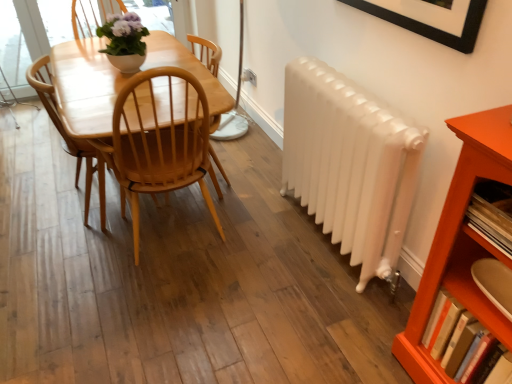
The image size is (512, 384). Find the location of `matte white pot at upper center`. matte white pot at upper center is located at coordinates (124, 41).

Describe the element at coordinates (455, 226) in the screenshot. I see `orange wood shelf at lower right` at that location.

The width and height of the screenshot is (512, 384). In order to click on light brown wood chair at center in this screenshot , I will do `click(70, 136)`.

Locate an element on the screen. The image size is (512, 384). hardcover book at lower right, the 1th book when ordered from bottom to top is located at coordinates (450, 333).

The width and height of the screenshot is (512, 384). Describe the element at coordinates (492, 214) in the screenshot. I see `wooden bookshelf at right, the 1th book viewed from the top` at that location.

Find the location of a particular element. The width and height of the screenshot is (512, 384). matte white pot at upper center is located at coordinates (124, 41).

Between hardcover book at lower right, the 1th book when ordered from bottom to top, and orange wood shelf at lower right, which one has smaller size?

With smaller size is hardcover book at lower right, the 1th book when ordered from bottom to top.

At what (x,y) coordinates should I click in order to perform the action: click on shelf on the left of the hardcover book at lower right, the 1th book when ordered from bottom to top. Please return your answer as a coordinate pair (x, y). This screenshot has height=384, width=512. Looking at the image, I should click on (455, 226).

Is hardcover book at lower right, the second book when ordered from top to bottom, in front of or behind orange wood shelf at lower right in the image?

hardcover book at lower right, the second book when ordered from top to bottom, is positioned farther from the viewer than orange wood shelf at lower right.

Which point is more distant from viewer, (476, 326) or (494, 115)?

Positioned behind is point (476, 326).

In order to click on chair to the left of matte white pot at upper center in this screenshot , I will do `click(70, 136)`.

Which object is positioned more to the right, matte white pot at upper center or light brown wood chair at center?

matte white pot at upper center is more to the right.

Is the position of matte white pot at upper center more distant than that of light brown wood chair at center?

Yes, it is.

Who is taller, matte white pot at upper center or light brown wood chair at center?

Standing taller between the two is light brown wood chair at center.

From the image's perspective, which is below, orange wood shelf at lower right or matte white pot at upper center?

orange wood shelf at lower right appears lower in the image.

Would you say orange wood shelf at lower right contains matte white pot at upper center?

That's incorrect, matte white pot at upper center is not inside orange wood shelf at lower right.

The width and height of the screenshot is (512, 384). I want to click on houseplant lying on the left of orange wood shelf at lower right, so click(x=124, y=41).

In the scene shown: Between orange wood shelf at lower right and matte white pot at upper center, which one is positioned in front?

Positioned in front is orange wood shelf at lower right.

Is orange wood shelf at lower right beside light brown wood chair at center?

No, orange wood shelf at lower right is not beside light brown wood chair at center.

Considering the sizes of objects orange wood shelf at lower right and light brown wood chair at center in the image provided, who is taller, orange wood shelf at lower right or light brown wood chair at center?

Standing taller between the two is orange wood shelf at lower right.

Is orange wood shelf at lower right completely or partially outside of light brown wood chair at center?

Indeed, orange wood shelf at lower right is completely outside light brown wood chair at center.

Considering their positions, is orange wood shelf at lower right located in front of or behind light brown wood chair at center?

Clearly, orange wood shelf at lower right is in front of light brown wood chair at center.

I want to click on shelf that appears above the hardcover book at lower right, the second book when ordered from top to bottom (from the image's perspective), so click(x=455, y=226).

Between orange wood shelf at lower right and hardcover book at lower right, the second book when ordered from top to bottom, which one has less height?

With less height is hardcover book at lower right, the second book when ordered from top to bottom.

Which is less distant, (504, 182) or (456, 311)?

Point (504, 182).

Is orange wood shelf at lower right not within hardcover book at lower right, the 1th book when ordered from bottom to top?

orange wood shelf at lower right lies outside hardcover book at lower right, the 1th book when ordered from bottom to top,'s area.

Considering the points (37, 84) and (446, 292), which point is behind, point (37, 84) or point (446, 292)?

The point (37, 84) is behind.

From a real-world perspective, who is located higher, light brown wood chair at center or hardcover book at lower right, the second book when ordered from top to bottom?

In real-world perspective, light brown wood chair at center is above.

Does light brown wood chair at center have a greater height compared to hardcover book at lower right, the second book when ordered from top to bottom?

Indeed, light brown wood chair at center has a greater height compared to hardcover book at lower right, the second book when ordered from top to bottom.

Is light brown wood chair at center positioned far away from hardcover book at lower right, the 1th book when ordered from bottom to top?

Yes, light brown wood chair at center and hardcover book at lower right, the 1th book when ordered from bottom to top, are quite far apart.

Is wooden bookshelf at right, the 1th book viewed from the top, wider than light brown wood chair at center?

No.

From the image's perspective, is wooden bookshelf at right, the 1th book viewed from the top, positioned above or below light brown wood chair at center?

Clearly, from the image's perspective, wooden bookshelf at right, the 1th book viewed from the top, is below light brown wood chair at center.

Is point (470, 212) more distant than point (102, 224)?

No, (470, 212) is in front of (102, 224).

From a real-world perspective, is wooden bookshelf at right, placed as the second book when sorted from bottom to top, physically located above or below light brown wood chair at center?

Clearly, from a real-world perspective, wooden bookshelf at right, placed as the second book when sorted from bottom to top, is above light brown wood chair at center.

At what (x,y) coordinates should I click in order to perform the action: click on shelf that appears above the hardcover book at lower right, the second book when ordered from top to bottom (from a real-world perspective). Please return your answer as a coordinate pair (x, y). Looking at the image, I should click on (455, 226).

Identify the location of chair on the left side of matte white pot at upper center. (70, 136).

Which object lies further to the anchor point light brown wood chair at center, wooden bookshelf at right, placed as the second book when sorted from bottom to top, or orange wood shelf at lower right?

Based on the image, wooden bookshelf at right, placed as the second book when sorted from bottom to top, appears to be further to light brown wood chair at center.

Considering their positions, is light brown wood chair at center positioned closer to hardcover book at lower right, the second book when ordered from top to bottom, than white glossy radiator at right?

white glossy radiator at right lies closer to hardcover book at lower right, the second book when ordered from top to bottom, than the other object.

Estimate the real-world distances between objects in this image. Which object is closer to orange wood shelf at lower right, light brown wood chair at center or white glossy radiator at right?

Based on the image, white glossy radiator at right appears to be nearer to orange wood shelf at lower right.

Estimate the real-world distances between objects in this image. Which object is closer to light brown wood chair at center, orange wood shelf at lower right or matte white pot at upper center?

Based on the image, matte white pot at upper center appears to be nearer to light brown wood chair at center.

Considering their positions, is wooden bookshelf at right, placed as the second book when sorted from bottom to top, positioned closer to hardcover book at lower right, the 1th book when ordered from bottom to top, than orange wood shelf at lower right?

The object closer to hardcover book at lower right, the 1th book when ordered from bottom to top, is orange wood shelf at lower right.

Estimate the real-world distances between objects in this image. Which object is further from white glossy radiator at right, light brown wood chair at center or hardcover book at lower right, the 1th book when ordered from bottom to top?

light brown wood chair at center is further to white glossy radiator at right.

Estimate the real-world distances between objects in this image. Which object is closer to matte white pot at upper center, orange wood shelf at lower right or light brown wood chair at center?

light brown wood chair at center is closer to matte white pot at upper center.

Looking at the image, which one is located further to light brown wood chair at center, hardcover book at lower right, the 1th book when ordered from bottom to top, or wooden bookshelf at right, the 1th book viewed from the top?

Based on the image, wooden bookshelf at right, the 1th book viewed from the top, appears to be further to light brown wood chair at center.

Find the location of a particular element. The width and height of the screenshot is (512, 384). book between light brown wood chair at center and hardcover book at lower right, the second book when ordered from top to bottom, in the horizontal direction is located at coordinates (492, 214).

What are the coordinates of `radiator between light brown wood chair at center and hardcover book at lower right, the second book when ordered from top to bottom, from left to right` in the screenshot? It's located at (350, 164).

Find the location of `shelf that lies between white glossy radiator at right and hardcover book at lower right, the second book when ordered from top to bottom, from top to bottom`. shelf that lies between white glossy radiator at right and hardcover book at lower right, the second book when ordered from top to bottom, from top to bottom is located at coordinates (455, 226).

Locate an element on the screen. This screenshot has height=384, width=512. radiator located between light brown wood chair at center and wooden bookshelf at right, placed as the second book when sorted from bottom to top, in the left-right direction is located at coordinates (350, 164).